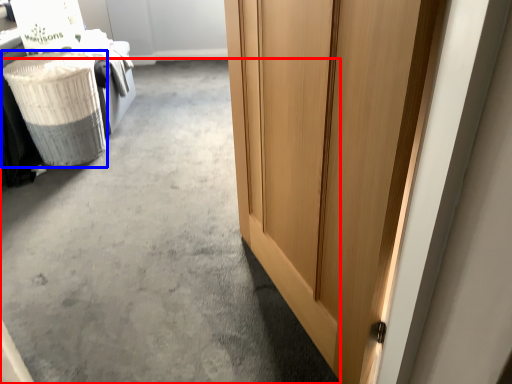
Question: Which point is further to the camera, concrete (highlighted by a red box) or laundry basket (highlighted by a blue box)?

Choices:
 (A) concrete
 (B) laundry basket

Answer: (B)